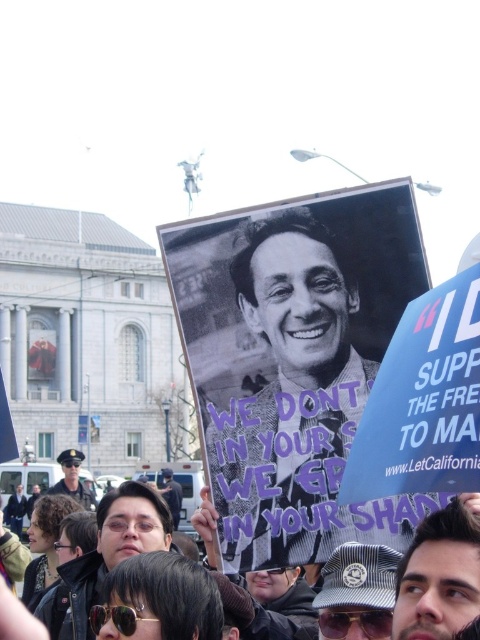
This screenshot has height=640, width=480. What are the coordinates of `black paper poster at center` in the screenshot? It's located at (292, 360).

Does black paper poster at center have a smaller size compared to uniformed officer at center?

Correct, black paper poster at center occupies less space than uniformed officer at center.

Does point (240, 342) come behind point (87, 502)?

No, (240, 342) is in front of (87, 502).

You are a GUI agent. You are given a task and a screenshot of the screen. Output one action in this format:
    pyautogui.click(x=<x>, y=<y>)
    Task: Click on the black paper poster at center
    
    Given the screenshot: What is the action you would take?
    click(292, 360)

Looking at this image, can you confirm if striped fabric cap at center is positioned to the right of matte black sunglasses at center?

Result: Indeed, striped fabric cap at center is positioned on the right side of matte black sunglasses at center.

Which of these two, striped fabric cap at center or matte black sunglasses at center, stands shorter?

striped fabric cap at center

The height and width of the screenshot is (640, 480). Describe the element at coordinates (358, 592) in the screenshot. I see `striped fabric cap at center` at that location.

Find the location of `striped fabric cap at center`. striped fabric cap at center is located at coordinates (x=358, y=592).

Is uniformed officer at center to the left of matte black sunglasses at center from the viewer's perspective?

Correct, you'll find uniformed officer at center to the left of matte black sunglasses at center.

Can you confirm if uniformed officer at center is positioned to the right of matte black sunglasses at center?

Incorrect, uniformed officer at center is not on the right side of matte black sunglasses at center.

Between point (57, 458) and point (176, 492), which one is positioned in front?

Positioned in front is point (176, 492).

Identify the location of uniformed officer at center. The width and height of the screenshot is (480, 640). (72, 480).